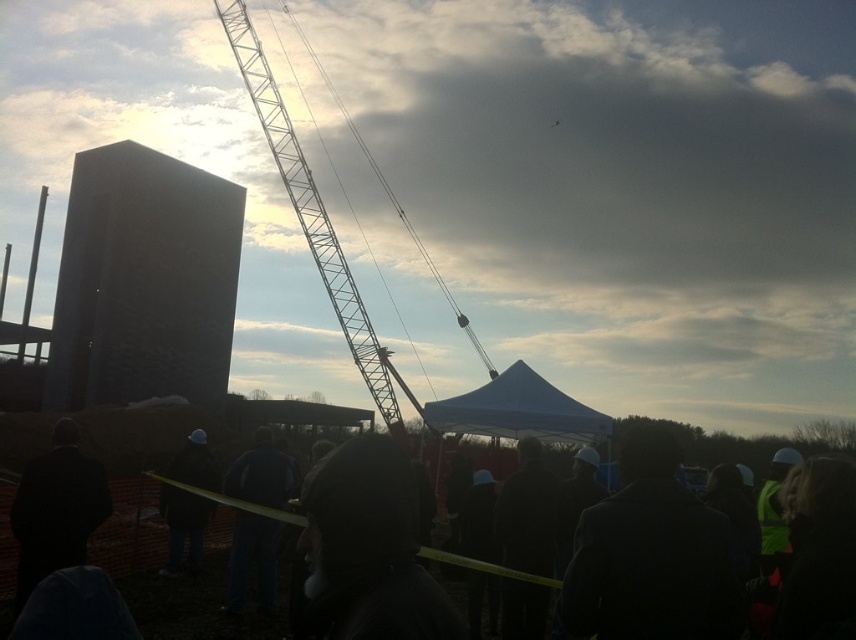
Is white metallic crane at upper center closer to the viewer compared to dark suit at lower left?

Yes, it is in front of dark suit at lower left.

Does point (337, 307) lie behind point (55, 436)?

Yes, it is behind point (55, 436).

Measure the distance between white metallic crane at upper center and camera.

A distance of 98.16 meters exists between white metallic crane at upper center and camera.

This screenshot has width=856, height=640. What are the coordinates of `white metallic crane at upper center` in the screenshot? It's located at (314, 220).

Does black fabric crowd at lower center have a larger size compared to dark suit at lower left?

Correct, black fabric crowd at lower center is larger in size than dark suit at lower left.

Does black fabric crowd at lower center have a greater width compared to dark suit at lower left?

Indeed, black fabric crowd at lower center has a greater width compared to dark suit at lower left.

What do you see at coordinates (189, 602) in the screenshot?
I see `black fabric crowd at lower center` at bounding box center [189, 602].

What are the coordinates of `black fabric crowd at lower center` in the screenshot? It's located at (189, 602).

Is dark suit at lower left closer to camera compared to dark fabric jacket at center?

Yes, it is in front of dark fabric jacket at center.

Can you confirm if dark suit at lower left is positioned to the right of dark fabric jacket at center?

No, dark suit at lower left is not to the right of dark fabric jacket at center.

Which is behind, point (24, 529) or point (189, 568)?

The point (189, 568) is more distant.

The height and width of the screenshot is (640, 856). Find the location of `dark suit at lower left`. dark suit at lower left is located at coordinates (56, 509).